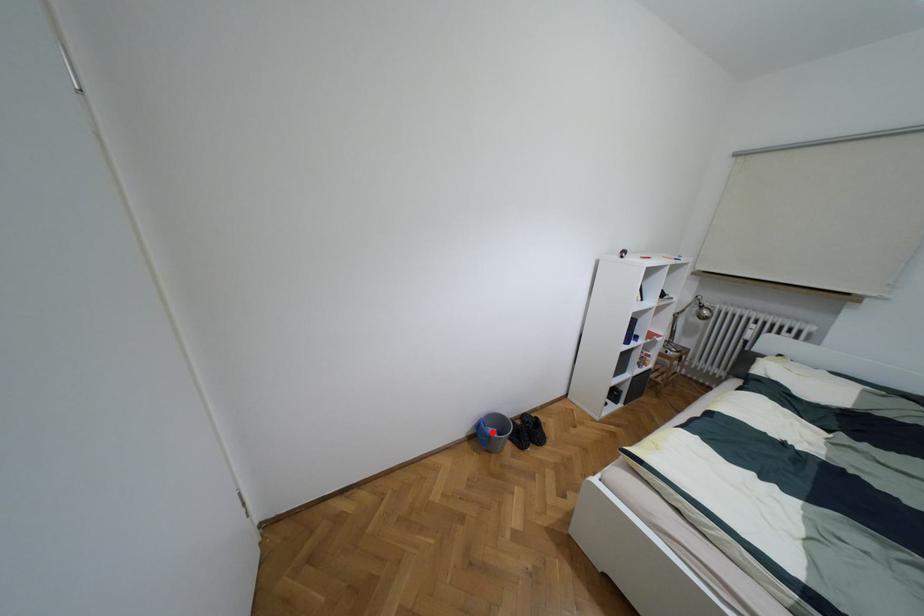
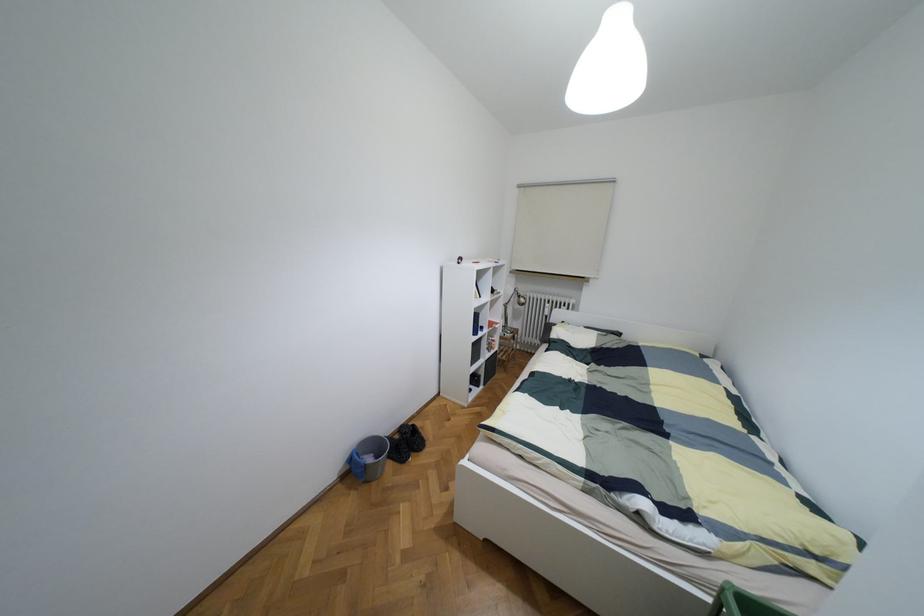
Find the pixel in the second image that matches the highlighted location in the first image.

(369, 459)